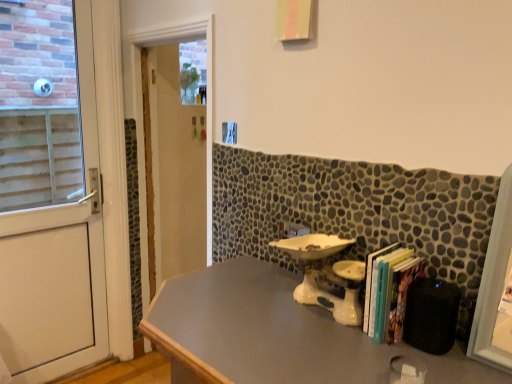
Locate an element on the screen. The image size is (512, 384). vacant space behind white ceramic sink at center is located at coordinates (274, 272).